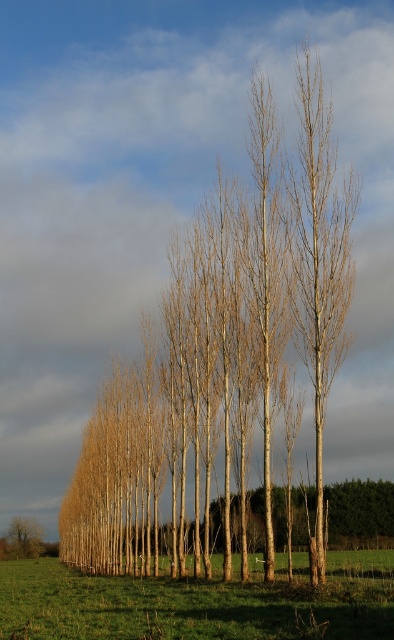
Question: Can you confirm if smooth light brown birch tree at center is positioned to the right of brown smooth tree at lower left?

Choices:
 (A) no
 (B) yes

Answer: (B)

Question: Is green grass at lower left positioned at the back of smooth light brown birch tree at center?

Choices:
 (A) no
 (B) yes

Answer: (A)

Question: Among these objects, which one is nearest to the camera?

Choices:
 (A) smooth light brown birch tree at center
 (B) green grass at lower left
 (C) brown smooth tree at lower left
 (D) smooth brown tree at center

Answer: (B)

Question: Is the position of green grass at lower left more distant than that of smooth light brown birch tree at center?

Choices:
 (A) yes
 (B) no

Answer: (B)

Question: Which of these objects is positioned farthest from the brown smooth tree at lower left?

Choices:
 (A) smooth light brown birch tree at center
 (B) green grass at lower left
 (C) smooth brown tree at center

Answer: (A)

Question: Which is farther from the smooth light brown birch tree at center?

Choices:
 (A) smooth brown tree at center
 (B) brown smooth tree at lower left

Answer: (B)